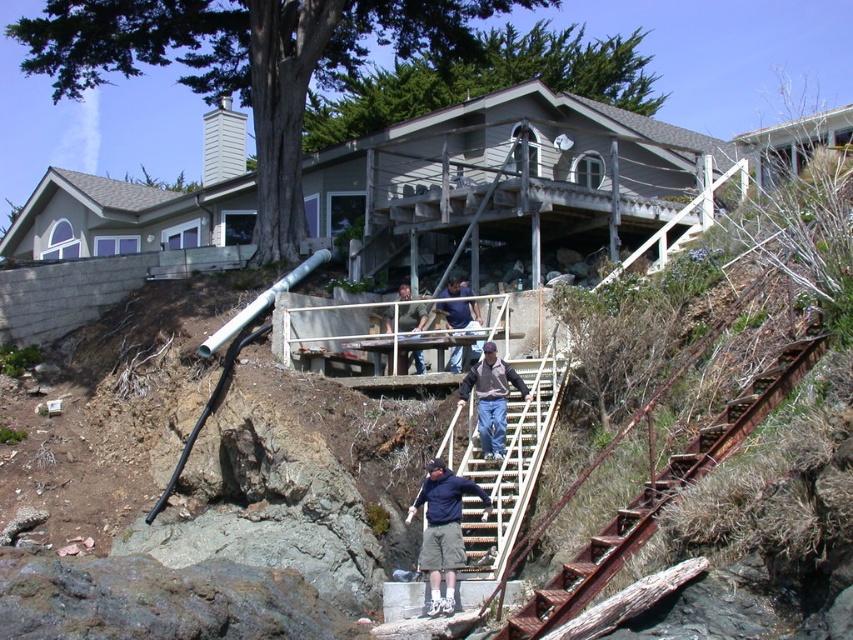
Question: Is metallic silver stairs at center wider than denim jacket at center?

Choices:
 (A) no
 (B) yes

Answer: (B)

Question: Does dark blue jacket at center appear on the left side of dark blue shirt at center?

Choices:
 (A) no
 (B) yes

Answer: (B)

Question: Which point is closer to the camera?

Choices:
 (A) (503, 369)
 (B) (430, 596)
 (C) (450, 289)

Answer: (B)

Question: Which object is positioned closest to the rusty metal stairs at lower right?

Choices:
 (A) denim jacket at center
 (B) metallic silver stairs at center

Answer: (B)

Question: From the image, what is the correct spatial relationship of metallic silver stairs at center in relation to dark blue shirt at center?

Choices:
 (A) right
 (B) left

Answer: (A)

Question: Based on their relative distances, which object is farther from the denim jacket at center?

Choices:
 (A) matte gray shirt at center
 (B) dark blue shirt at center
 (C) rusty metal stairs at lower right

Answer: (A)